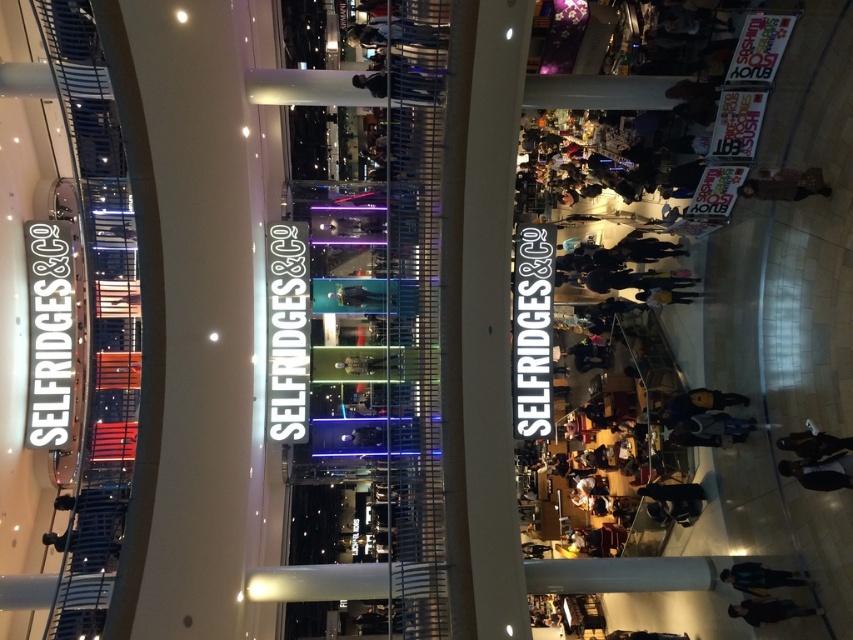
Is dark gray sweater at center bigger than leather jacket at lower right?

Yes.

Can you confirm if dark gray sweater at center is positioned above leather jacket at lower right?

Indeed, dark gray sweater at center is positioned over leather jacket at lower right.

Find the location of `dark gray sweater at center`. dark gray sweater at center is located at coordinates (694, 404).

Locate an element on the screen. The height and width of the screenshot is (640, 853). dark gray sweater at center is located at coordinates (694, 404).

Which is below, metallic silver escalator at left or leather jacket at lower right?

Positioned lower is leather jacket at lower right.

Looking at this image, which is above, metallic silver escalator at left or leather jacket at lower right?

metallic silver escalator at left

Where is `metallic silver escalator at left`? The height and width of the screenshot is (640, 853). metallic silver escalator at left is located at coordinates (97, 312).

Does point (740, 397) lie behind point (802, 582)?

Yes, it is.

Can you confirm if dark gray sweater at center is bigger than dark blue jacket at lower right?

Indeed, dark gray sweater at center has a larger size compared to dark blue jacket at lower right.

Between point (689, 413) and point (762, 580), which one is positioned behind?

The point (689, 413) is behind.

You are a GUI agent. You are given a task and a screenshot of the screen. Output one action in this format:
    pyautogui.click(x=<x>, y=<y>)
    Task: Click on the dark gray sweater at center
    This screenshot has height=640, width=853.
    Given the screenshot: What is the action you would take?
    pyautogui.click(x=694, y=404)